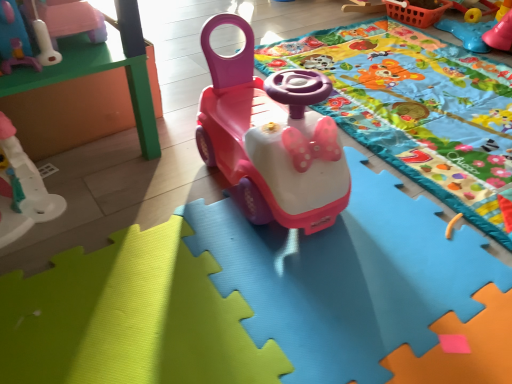
The height and width of the screenshot is (384, 512). What do you see at coordinates (468, 33) in the screenshot?
I see `rubberized blue steering wheel at upper right, the first toy viewed from the right` at bounding box center [468, 33].

This screenshot has height=384, width=512. Find the location of `rubberized blue steering wheel at upper right, positioned as the fourth toy in left-to-right order`. rubberized blue steering wheel at upper right, positioned as the fourth toy in left-to-right order is located at coordinates (468, 33).

This screenshot has width=512, height=384. Describe the element at coordinates (416, 13) in the screenshot. I see `orange plastic basket at upper right` at that location.

Describe the element at coordinates (71, 19) in the screenshot. The width and height of the screenshot is (512, 384). I see `matte pink toy at upper left, which is the third toy from right to left` at that location.

Identify the location of matte pink toy at upper left, which is the third toy from right to left. (71, 19).

What is the approximate height of white plastic toy at left, which is the 1th toy from left to right?

9.62 inches.

Where is `white plastic toy at left, which is the fourth toy in right-to-left order`? This screenshot has height=384, width=512. white plastic toy at left, which is the fourth toy in right-to-left order is located at coordinates (21, 189).

Locate an element on the screen. Image resolution: width=512 pixels, height=384 pixels. green matte table at upper left is located at coordinates (92, 74).

What's the angular difference between matte plastic blanket at center and rubberized blue steering wheel at upper right, the first toy viewed from the right,'s facing directions?

They differ by 92.7 degrees in their facing directions.

From the image's perspective, would you say matte plastic blanket at center is shown under rubberized blue steering wheel at upper right, positioned as the fourth toy in left-to-right order?

Yes, from the image's perspective, matte plastic blanket at center is below rubberized blue steering wheel at upper right, positioned as the fourth toy in left-to-right order.

Considering the relative sizes of matte plastic blanket at center and rubberized blue steering wheel at upper right, positioned as the fourth toy in left-to-right order, in the image provided, is matte plastic blanket at center thinner than rubberized blue steering wheel at upper right, positioned as the fourth toy in left-to-right order,?

No.

Which point is more forward, (452,22) or (2,208)?

The point (2,208) is closer.

From a real-world perspective, between rubberized blue steering wheel at upper right, the first toy viewed from the right, and white plastic toy at left, which is the 1th toy from left to right, who is vertically higher?

In real-world perspective, white plastic toy at left, which is the 1th toy from left to right, is above.

Considering the relative sizes of rubberized blue steering wheel at upper right, positioned as the fourth toy in left-to-right order, and white plastic toy at left, which is the 1th toy from left to right, in the image provided, is rubberized blue steering wheel at upper right, positioned as the fourth toy in left-to-right order, shorter than white plastic toy at left, which is the 1th toy from left to right,?

Indeed, rubberized blue steering wheel at upper right, positioned as the fourth toy in left-to-right order, has a lesser height compared to white plastic toy at left, which is the 1th toy from left to right.

Considering the positions of objects rubberized blue steering wheel at upper right, positioned as the fourth toy in left-to-right order, and white plastic toy at left, which is the 1th toy from left to right, in the image provided, who is in front, rubberized blue steering wheel at upper right, positioned as the fourth toy in left-to-right order, or white plastic toy at left, which is the 1th toy from left to right,?

Positioned in front is white plastic toy at left, which is the 1th toy from left to right.

Considering their positions, is matte plastic blanket at center located in front of or behind green matte table at upper left?

matte plastic blanket at center is in front of green matte table at upper left.

From the image's perspective, which object appears higher, matte plastic blanket at center or green matte table at upper left?

green matte table at upper left.

Which is more to the left, matte plastic blanket at center or green matte table at upper left?

green matte table at upper left is more to the left.

Is matte plastic blanket at center positioned beyond the bounds of white plastic toy at left, which is the 1th toy from left to right?

matte plastic blanket at center lies outside white plastic toy at left, which is the 1th toy from left to right,'s area.

Does point (374, 147) appear closer or farther from the camera than point (21, 168)?

Point (374, 147) is positioned farther from the camera compared to point (21, 168).

Is white plastic toy at left, which is the 1th toy from left to right, at the back of matte plastic blanket at center?

No, matte plastic blanket at center is not facing away from white plastic toy at left, which is the 1th toy from left to right.

From the image's perspective, which one is positioned lower, rubberized blue steering wheel at upper right, the first toy viewed from the right, or green matte table at upper left?

From the image's view, green matte table at upper left is below.

Considering the sizes of objects rubberized blue steering wheel at upper right, the first toy viewed from the right, and green matte table at upper left in the image provided, who is bigger, rubberized blue steering wheel at upper right, the first toy viewed from the right, or green matte table at upper left?

With larger size is green matte table at upper left.

What's the angular difference between rubberized blue steering wheel at upper right, the first toy viewed from the right, and green matte table at upper left's facing directions?

There is a 175-degree angle between the facing directions of rubberized blue steering wheel at upper right, the first toy viewed from the right, and green matte table at upper left.

Between rubberized blue steering wheel at upper right, positioned as the fourth toy in left-to-right order, and green matte table at upper left, which one has less height?

With less height is rubberized blue steering wheel at upper right, positioned as the fourth toy in left-to-right order.

Does matte plastic car at center, placed as the 3th toy when sorted from left to right, have a greater height compared to orange plastic basket at upper right?

Indeed, matte plastic car at center, placed as the 3th toy when sorted from left to right, has a greater height compared to orange plastic basket at upper right.

Relative to orange plastic basket at upper right, is matte plastic car at center, the second toy viewed from the right, in front or behind?

Clearly, matte plastic car at center, the second toy viewed from the right, is in front of orange plastic basket at upper right.

Looking at this image, in terms of width, does matte plastic car at center, the second toy viewed from the right, look wider or thinner when compared to orange plastic basket at upper right?

In the image, matte plastic car at center, the second toy viewed from the right, appears to be more narrow than orange plastic basket at upper right.

Identify the location of the 3rd toy below the orange plastic basket at upper right (from the image's perspective). click(x=271, y=139).

From the image's perspective, is matte pink toy at upper left, which is the third toy from right to left, above or below orange plastic basket at upper right?

Clearly, from the image's perspective, matte pink toy at upper left, which is the third toy from right to left, is below orange plastic basket at upper right.

Which object is wider, matte pink toy at upper left, acting as the 2th toy starting from the left, or orange plastic basket at upper right?

Wider between the two is orange plastic basket at upper right.

Based on their sizes in the image, would you say matte pink toy at upper left, which is the third toy from right to left, is bigger or smaller than orange plastic basket at upper right?

Considering their sizes, matte pink toy at upper left, which is the third toy from right to left, takes up less space than orange plastic basket at upper right.

From a real-world perspective, starting from the matte plastic blanket at center, which toy is the 1st one vertically above it? Please provide its 2D coordinates.

[(468, 33)]

Where is `toy that is the 3rd one when counting leftward from the rubberized blue steering wheel at upper right, the first toy viewed from the right`? The image size is (512, 384). toy that is the 3rd one when counting leftward from the rubberized blue steering wheel at upper right, the first toy viewed from the right is located at coordinates (21, 189).

Estimate the real-world distances between objects in this image. Which object is further from white plastic toy at left, which is the fourth toy in right-to-left order, matte plastic blanket at center or orange plastic basket at upper right?

The object further to white plastic toy at left, which is the fourth toy in right-to-left order, is orange plastic basket at upper right.

When comparing their distances from orange plastic basket at upper right, does green matte table at upper left or matte plastic car at center, placed as the 3th toy when sorted from left to right, seem closer?

The object closer to orange plastic basket at upper right is matte plastic car at center, placed as the 3th toy when sorted from left to right.

Which object lies nearer to the anchor point rubberized blue steering wheel at upper right, positioned as the fourth toy in left-to-right order, green matte table at upper left or orange plastic basket at upper right?

Among the two, orange plastic basket at upper right is located nearer to rubberized blue steering wheel at upper right, positioned as the fourth toy in left-to-right order.

Consider the image. Looking at the image, which one is located further to white plastic toy at left, which is the 1th toy from left to right, matte pink toy at upper left, acting as the 2th toy starting from the left, or matte plastic car at center, placed as the 3th toy when sorted from left to right?

Among the two, matte plastic car at center, placed as the 3th toy when sorted from left to right, is located further to white plastic toy at left, which is the 1th toy from left to right.

From the image, which object appears to be nearer to green matte table at upper left, white plastic toy at left, which is the fourth toy in right-to-left order, or orange plastic basket at upper right?

The object closer to green matte table at upper left is white plastic toy at left, which is the fourth toy in right-to-left order.

Considering their positions, is orange plastic basket at upper right positioned closer to rubberized blue steering wheel at upper right, the first toy viewed from the right, than matte plastic car at center, the second toy viewed from the right?

orange plastic basket at upper right lies closer to rubberized blue steering wheel at upper right, the first toy viewed from the right, than the other object.

Looking at the image, which one is located further to green matte table at upper left, orange plastic basket at upper right or matte plastic blanket at center?

The object further to green matte table at upper left is orange plastic basket at upper right.

Based on their spatial positions, is rubberized blue steering wheel at upper right, positioned as the fourth toy in left-to-right order, or orange plastic basket at upper right closer to green matte table at upper left?

orange plastic basket at upper right is closer to green matte table at upper left.

Locate an element on the screen. The height and width of the screenshot is (384, 512). blanket between green matte table at upper left and rubberized blue steering wheel at upper right, positioned as the fourth toy in left-to-right order, from left to right is located at coordinates (416, 108).

Where is `table that lies between matte pink toy at upper left, acting as the 2th toy starting from the left, and white plastic toy at left, which is the 1th toy from left to right, from top to bottom`? The image size is (512, 384). table that lies between matte pink toy at upper left, acting as the 2th toy starting from the left, and white plastic toy at left, which is the 1th toy from left to right, from top to bottom is located at coordinates (92, 74).

Locate an element on the screen. basket between matte pink toy at upper left, acting as the 2th toy starting from the left, and rubberized blue steering wheel at upper right, the first toy viewed from the right is located at coordinates (416, 13).

You are a GUI agent. You are given a task and a screenshot of the screen. Output one action in this format:
    pyautogui.click(x=<x>, y=<y>)
    Task: Click on the blanket between white plastic toy at left, which is the 1th toy from left to right, and orange plastic basket at upper right, in the horizontal direction
    This screenshot has height=384, width=512.
    Given the screenshot: What is the action you would take?
    pyautogui.click(x=416, y=108)